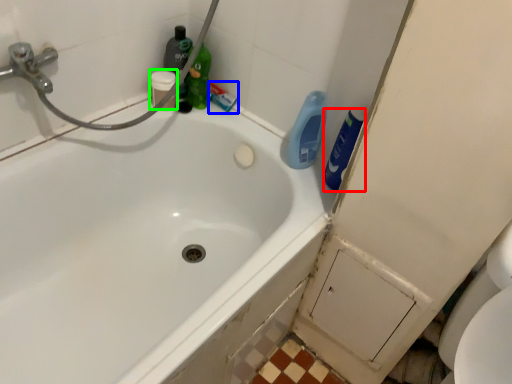
Question: Which object is the closest to the cleaning product (highlighted by a red box)? Choose among these: toothpaste (highlighted by a blue box) or toiletry (highlighted by a green box).

Choices:
 (A) toothpaste
 (B) toiletry

Answer: (A)